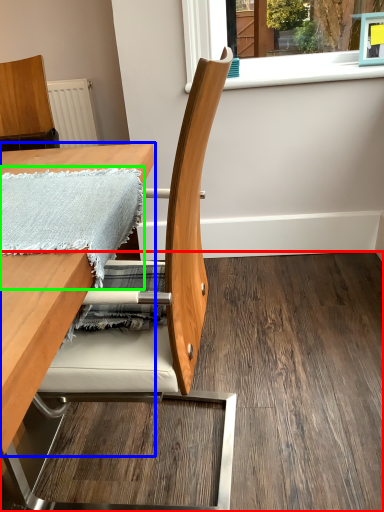
Question: Considering the real-world distances, which object is closest to plywood (highlighted by a red box)? table (highlighted by a blue box) or blanket (highlighted by a green box).

Choices:
 (A) table
 (B) blanket

Answer: (B)